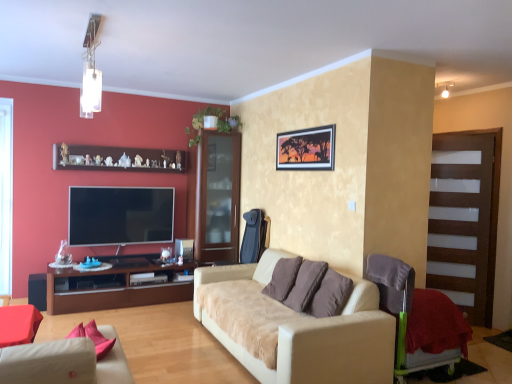
Image resolution: width=512 pixels, height=384 pixels. Find the location of `free space above matte black picture frame at upper center (from a real-world perspective)`. free space above matte black picture frame at upper center (from a real-world perspective) is located at coordinates (303, 127).